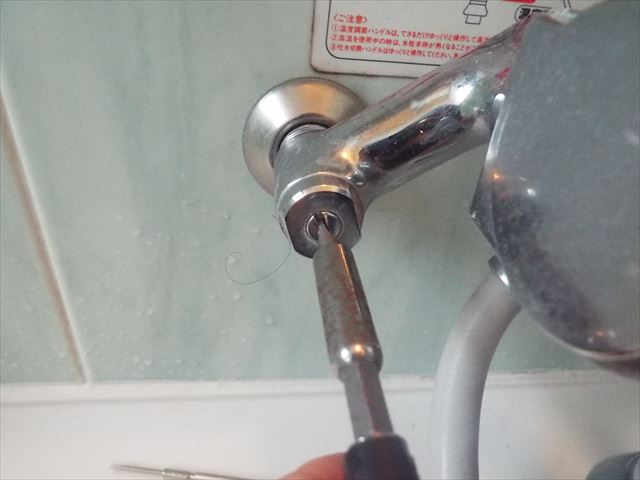
Where is `tiles`? tiles is located at coordinates pos(106,263).